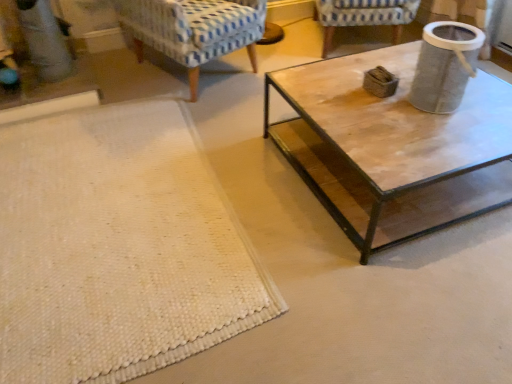
Question: Can you confirm if textured gray trash can at upper right is smaller than blue-patterned fabric chair at upper center, which is the first chair from right to left?

Choices:
 (A) yes
 (B) no

Answer: (A)

Question: From a real-world perspective, is textured gray trash can at upper right positioned over blue-patterned fabric chair at upper center, the 2th chair from the left, based on gravity?

Choices:
 (A) yes
 (B) no

Answer: (A)

Question: Does textured gray trash can at upper right turn towards blue-patterned fabric chair at upper center, which is the first chair from right to left?

Choices:
 (A) no
 (B) yes

Answer: (A)

Question: Is textured gray trash can at upper right turned away from blue-patterned fabric chair at upper center, the 2th chair from the left?

Choices:
 (A) yes
 (B) no

Answer: (B)

Question: Can you confirm if textured gray trash can at upper right is shorter than blue-patterned fabric chair at upper center, the 2th chair from the left?

Choices:
 (A) no
 (B) yes

Answer: (B)

Question: Which is correct: blue-patterned fabric chair at upper center, which is the first chair from right to left, is inside white woven mat at lower left, or outside of it?

Choices:
 (A) outside
 (B) inside

Answer: (A)

Question: Looking at the image, does blue-patterned fabric chair at upper center, which is the first chair from right to left, seem bigger or smaller compared to white woven mat at lower left?

Choices:
 (A) big
 (B) small

Answer: (A)

Question: Is point [369, 14] closer or farther from the camera than point [180, 120]?

Choices:
 (A) farther
 (B) closer

Answer: (A)

Question: Is blue-patterned fabric chair at upper center, which is the first chair from right to left, wider or thinner than white woven mat at lower left?

Choices:
 (A) wide
 (B) thin

Answer: (B)

Question: From the image's perspective, relative to blue patterned fabric chair at upper left, which is the 2th chair from right to left, is blue-patterned fabric chair at upper center, the 2th chair from the left, above or below?

Choices:
 (A) below
 (B) above

Answer: (B)

Question: In terms of size, does blue-patterned fabric chair at upper center, which is the first chair from right to left, appear bigger or smaller than blue patterned fabric chair at upper left, which is the 2th chair from right to left?

Choices:
 (A) big
 (B) small

Answer: (B)

Question: From a real-world perspective, is blue-patterned fabric chair at upper center, which is the first chair from right to left, above or below blue patterned fabric chair at upper left, which appears as the first chair when viewed from the left?

Choices:
 (A) above
 (B) below

Answer: (B)

Question: In terms of height, does blue-patterned fabric chair at upper center, which is the first chair from right to left, look taller or shorter compared to blue patterned fabric chair at upper left, which is the 2th chair from right to left?

Choices:
 (A) tall
 (B) short

Answer: (B)

Question: From their relative heights in the image, would you say blue-patterned fabric chair at upper center, the 2th chair from the left, is taller or shorter than textured gray trash can at upper right?

Choices:
 (A) tall
 (B) short

Answer: (A)

Question: Does point (365, 23) appear closer or farther from the camera than point (436, 109)?

Choices:
 (A) closer
 (B) farther

Answer: (B)